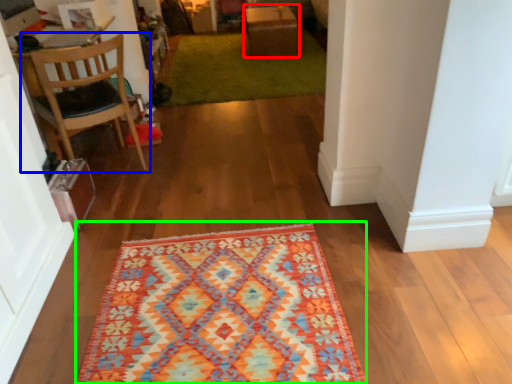
Question: Which object is the closest to the table (highlighted by a red box)? Choose among these: chair (highlighted by a blue box) or mat (highlighted by a green box).

Choices:
 (A) chair
 (B) mat

Answer: (A)